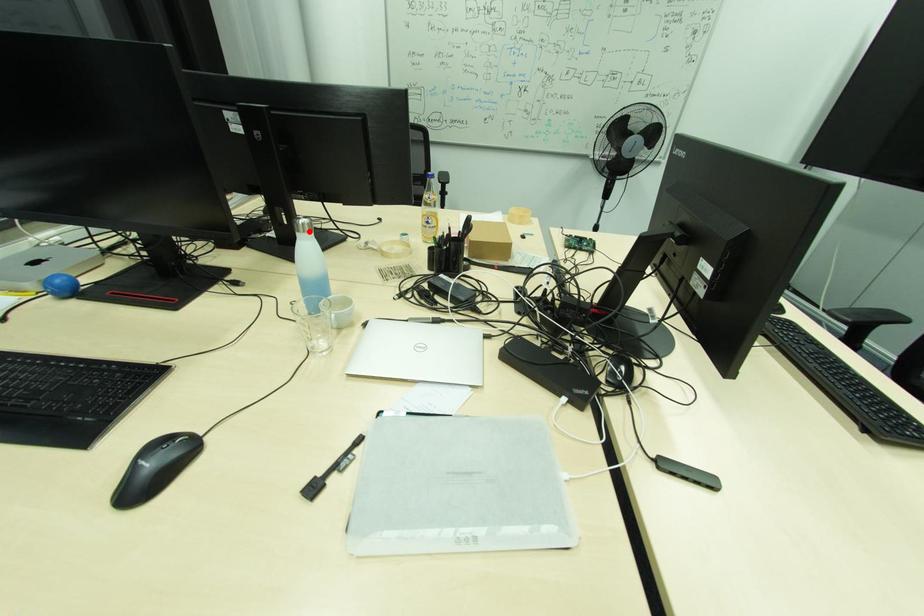
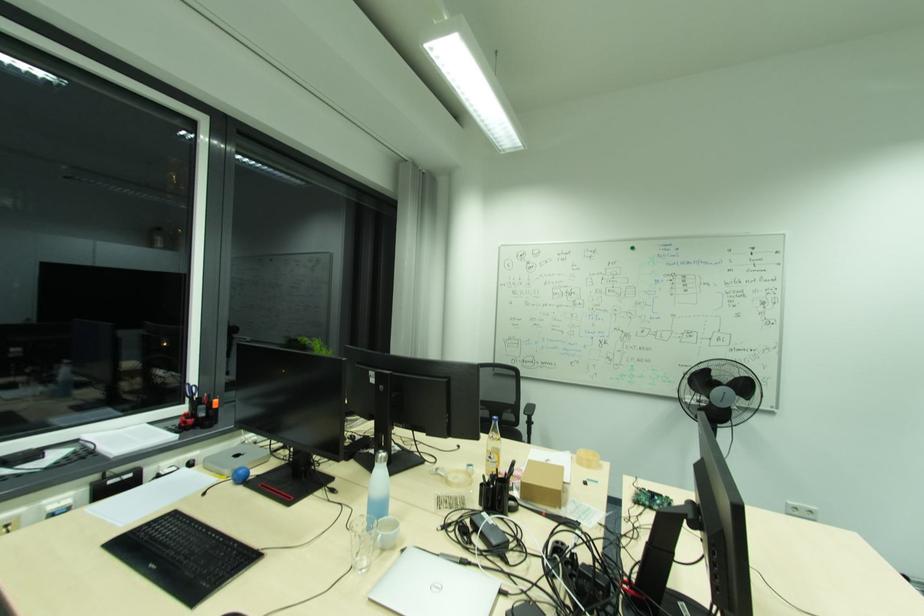
Question: I am providing you with two images of the same scene from different viewpoints. In image1, a red point is highlighted. Considering the same 3D point in image2, which of the following is correct?

Choices:
 (A) It is closer
 (B) It is farther

Answer: (B)